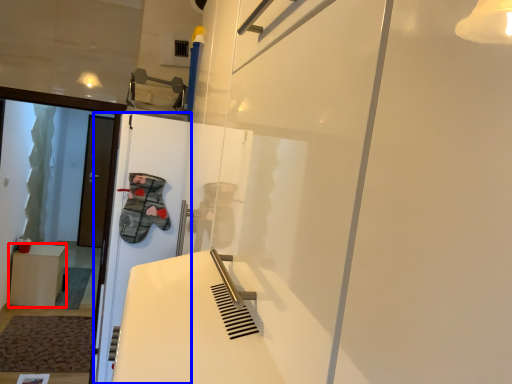
Question: Which of the following is the farthest to the observer, furniture (highlighted by a red box) or screen door (highlighted by a blue box)?

Choices:
 (A) furniture
 (B) screen door

Answer: (A)